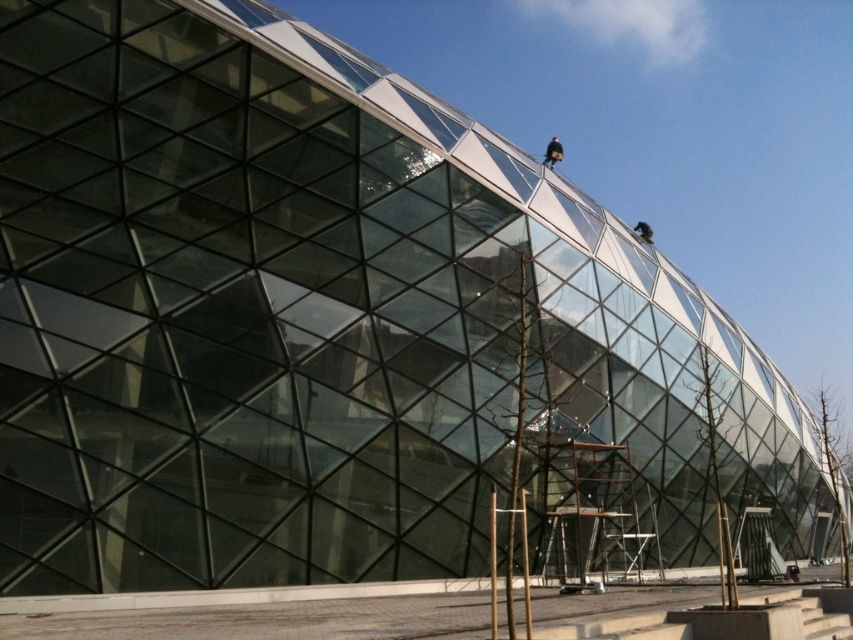
Between point (554, 147) and point (637, 225), which one is positioned behind?

Positioned behind is point (637, 225).

In the scene shown: Can you confirm if black fabric construction worker at upper center is thinner than dark brown leather helmet at upper right?

Indeed, black fabric construction worker at upper center has a lesser width compared to dark brown leather helmet at upper right.

What do you see at coordinates (552, 152) in the screenshot? I see `black fabric construction worker at upper center` at bounding box center [552, 152].

Where is `black fabric construction worker at upper center`? The image size is (853, 640). black fabric construction worker at upper center is located at coordinates (552, 152).